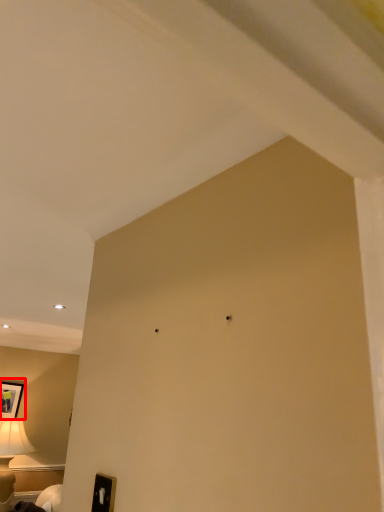
Question: Where is picture frame (annotated by the red box) located in relation to furniture in the image?

Choices:
 (A) left
 (B) right

Answer: (A)